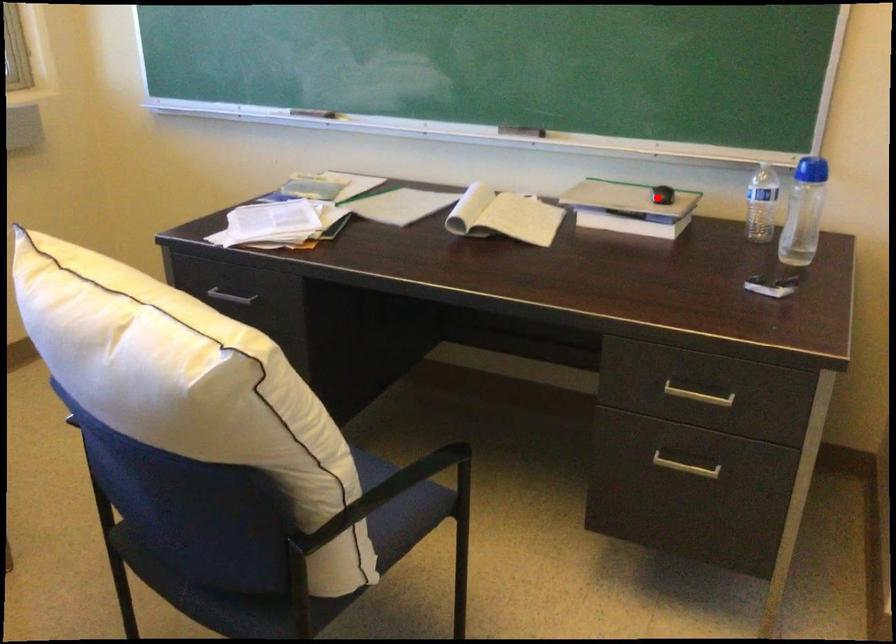
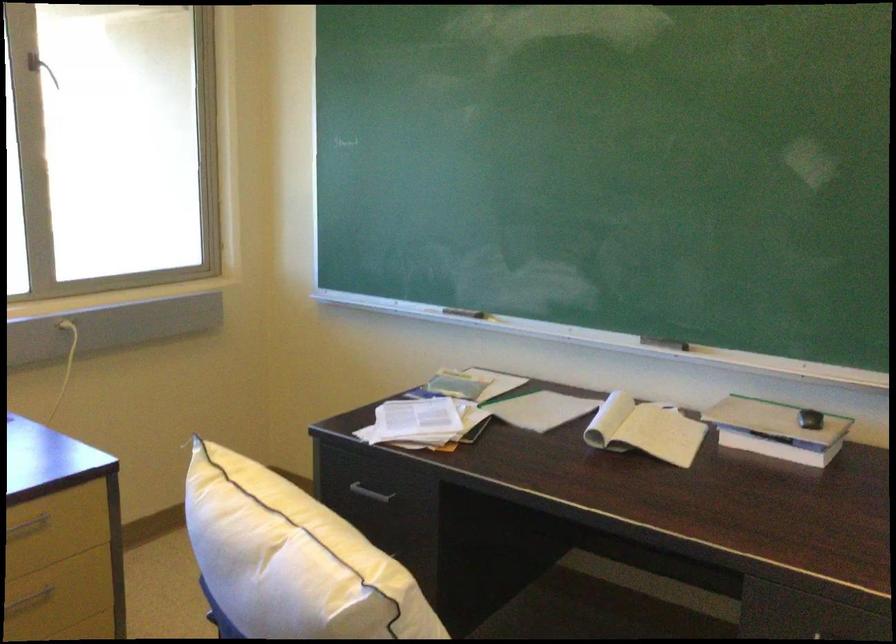
The point at the highlighted location is marked in the first image. Where is the corresponding point in the second image?

(810, 419)